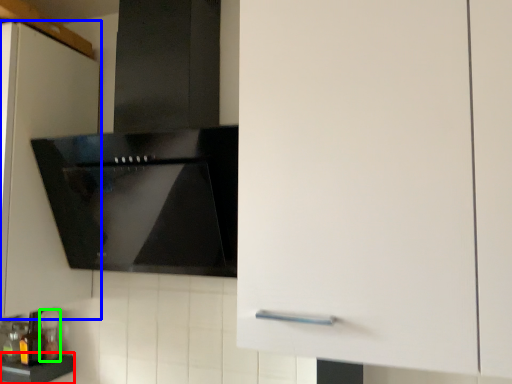
Question: Which object is the farthest from counter top (highlighted by a red box)? Choose among these: cabinetry (highlighted by a blue box) or bottle (highlighted by a green box).

Choices:
 (A) cabinetry
 (B) bottle

Answer: (A)